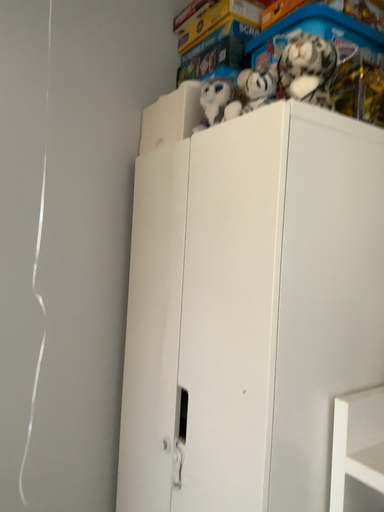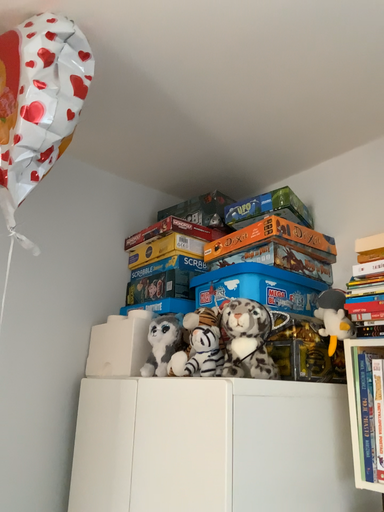
Question: How did the camera likely rotate when shooting the video?

Choices:
 (A) rotated downward
 (B) rotated upward

Answer: (B)